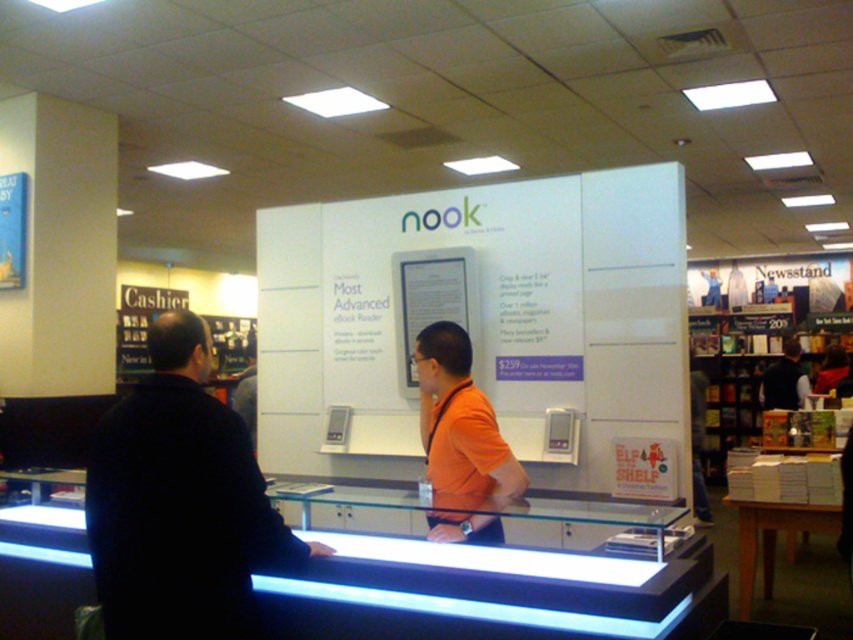
You are a customer standing at the entrance of the store. You see the transparent glass counter at center and the dark blue jacket at left. Which object is closer to you?

The transparent glass counter at center is closer to you because it is in front of the dark blue jacket at left.

You are a customer looking for the dark blue jacket at left in a store. You are currently standing at the transparent glass counter at center. Which direction should you move to find the jacket?

The dark blue jacket at left is to the left of the transparent glass counter at center. You should move to your left to find the jacket.